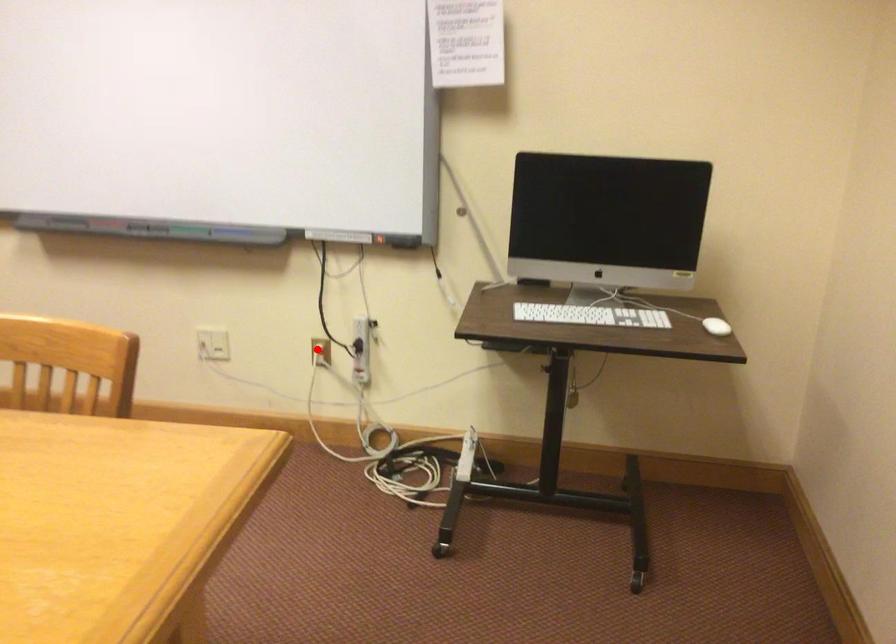
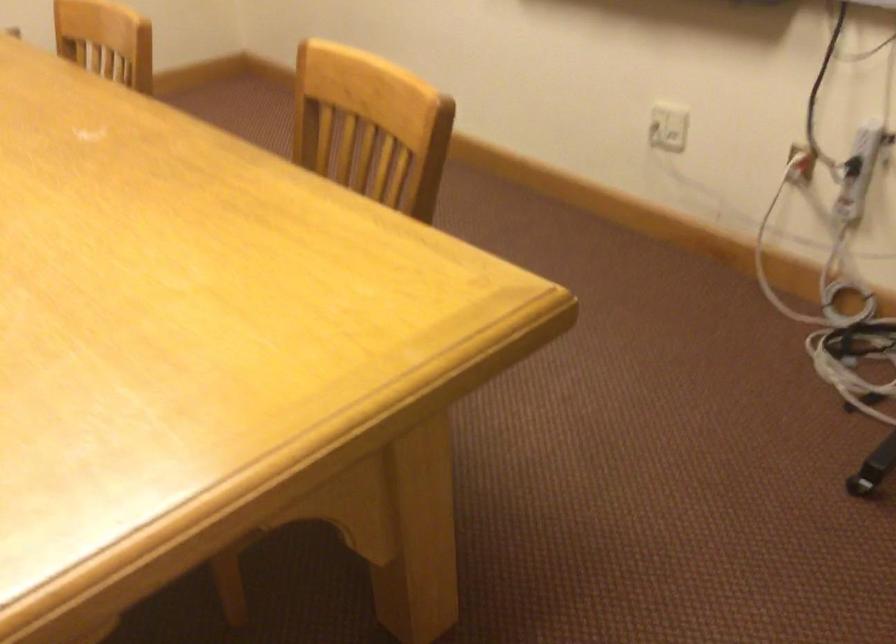
Locate, in the second image, the point that corresponds to the highlighted location in the first image.

(800, 164)